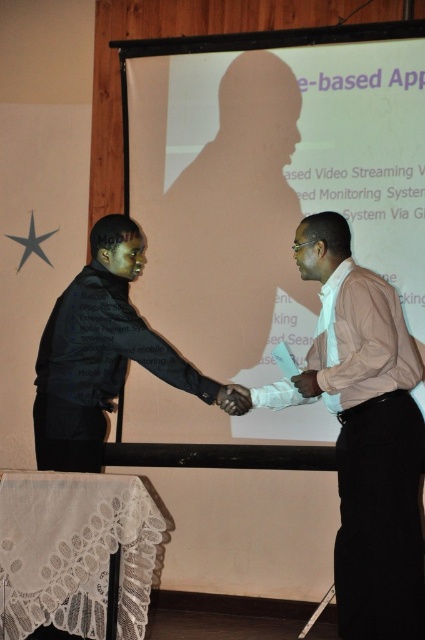
Between pink satin shirt at right and matte black hand at center, which one is positioned lower?

pink satin shirt at right is below.

Between point (373, 452) and point (221, 400), which one is positioned in front?

Positioned in front is point (373, 452).

The height and width of the screenshot is (640, 425). What are the coordinates of `pink satin shirt at right` in the screenshot? It's located at (365, 433).

Describe the element at coordinates (234, 400) in the screenshot. The image size is (425, 640). I see `matte black hand at center` at that location.

Between matte black hand at center and matte white hand at center, which one is positioned higher?

matte white hand at center is higher up.

Is point (226, 401) behind point (305, 374)?

No, (226, 401) is closer to viewer.

Identify the location of matte black hand at center. This screenshot has width=425, height=640. (234, 400).

Which is above, pink satin shirt at right or matte white hand at center?

matte white hand at center

Between pink satin shirt at right and matte white hand at center, which one has less height?

matte white hand at center

Describe the element at coordinates (365, 433) in the screenshot. I see `pink satin shirt at right` at that location.

The width and height of the screenshot is (425, 640). In order to click on pink satin shirt at right in this screenshot , I will do `click(365, 433)`.